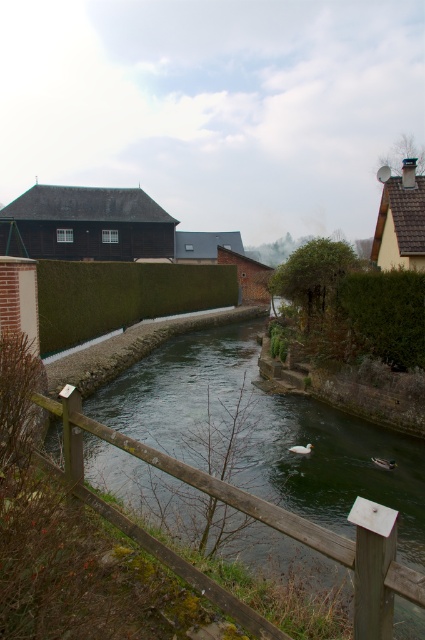
Looking at this image, is brown wooden fence at lower center taller than green leafy hedge at center?

In fact, brown wooden fence at lower center may be shorter than green leafy hedge at center.

Consider the image. Who is positioned more to the left, brown wooden fence at lower center or green leafy hedge at center?

green leafy hedge at center

Who is more distant from viewer, (359, 500) or (237, 289)?

Point (237, 289)

Image resolution: width=425 pixels, height=640 pixels. Identify the location of brown wooden fence at lower center. (274, 520).

Between point (212, 307) and point (360, 324), which one is positioned behind?

The point (212, 307) is more distant.

Who is more distant from viewer, (200, 266) or (382, 278)?

The point (200, 266) is behind.

You are a GUI agent. You are given a task and a screenshot of the screen. Output one action in this format:
    pyautogui.click(x=<x>, y=<y>)
    Task: Click on the green leafy hedge at center
    
    Given the screenshot: What is the action you would take?
    (121, 296)

Between point (385, 536) and point (402, 276), which one is positioned in front?

Positioned in front is point (385, 536).

Describe the element at coordinates (274, 520) in the screenshot. The height and width of the screenshot is (640, 425). I see `brown wooden fence at lower center` at that location.

The image size is (425, 640). I want to click on brown wooden fence at lower center, so click(x=274, y=520).